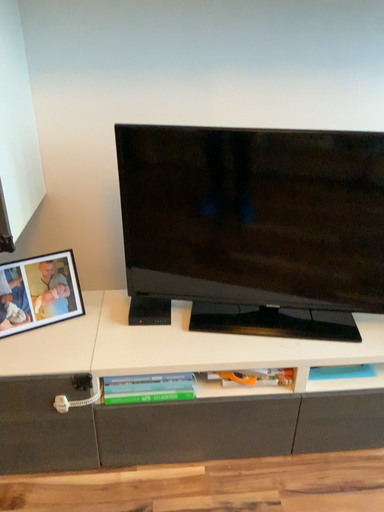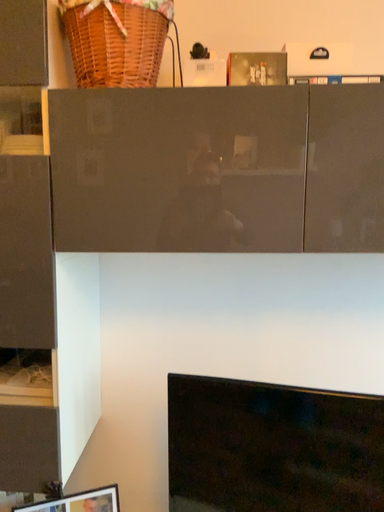
Question: Which way did the camera rotate in the video?

Choices:
 (A) rotated left
 (B) rotated right

Answer: (A)